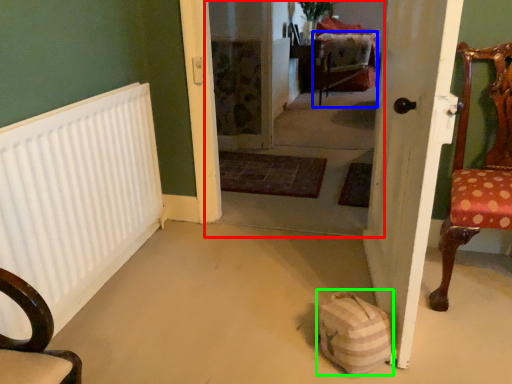
Question: Which is nearer to the corridor (highlighted by a red box)? armchair (highlighted by a blue box) or bag (highlighted by a green box).

Choices:
 (A) armchair
 (B) bag

Answer: (A)